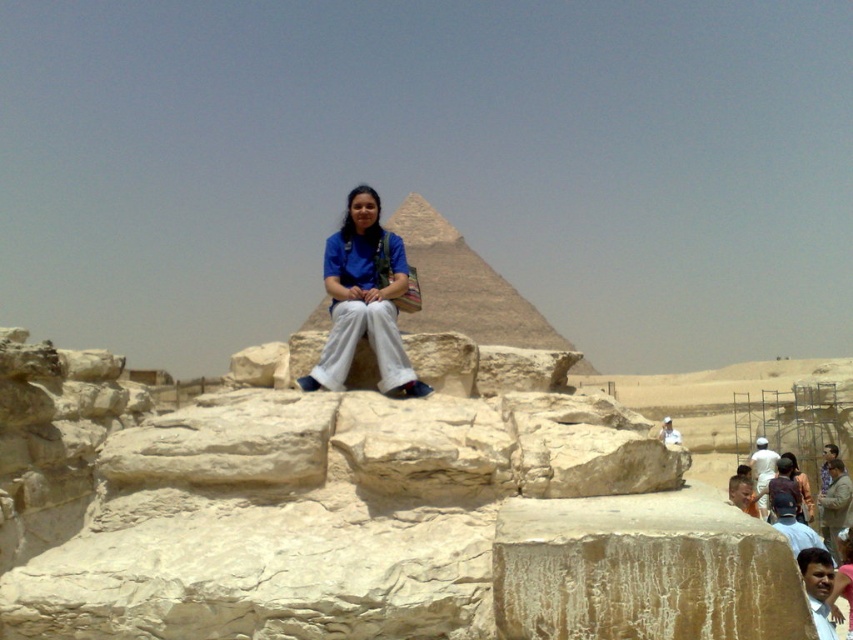
Question: Where is blue fabric shirt at center located in relation to light brown sandstone man at center in the image?

Choices:
 (A) right
 (B) left

Answer: (B)

Question: Observing the image, what is the correct spatial positioning of blue fabric shirt at center in reference to smooth skin face at center?

Choices:
 (A) left
 (B) right

Answer: (A)

Question: Which point is closer to the camera taking this photo?

Choices:
 (A) (375, 348)
 (B) (759, 499)
 (C) (811, 605)
 (D) (318, 324)

Answer: (A)

Question: Can you confirm if smooth beige pyramid at center is positioned above smooth skin face at center?

Choices:
 (A) yes
 (B) no

Answer: (A)

Question: Which of the following is the closest to the observer?

Choices:
 (A) smooth beige pyramid at center
 (B) white cotton shirt at center
 (C) light brown sandstone man at center

Answer: (A)

Question: Which point appears farthest from the camera in this image?

Choices:
 (A) (401, 342)
 (B) (809, 573)
 (C) (674, 435)
 (D) (795, 520)

Answer: (C)